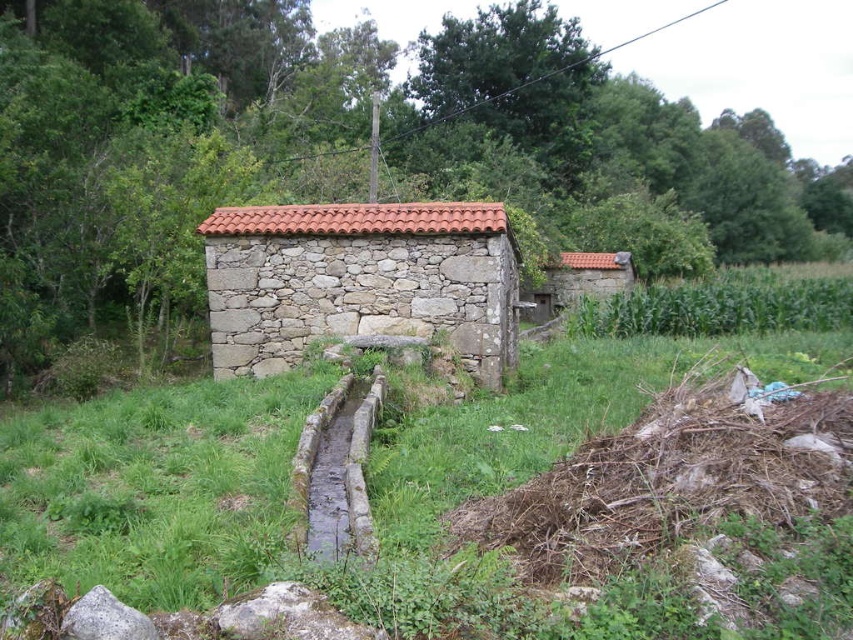
What do you see at coordinates (360, 280) in the screenshot?
I see `stone textured hut at center` at bounding box center [360, 280].

Does point (485, 268) come farther from viewer compared to point (802, 321)?

No, it is in front of (802, 321).

You are a GUI agent. You are given a task and a screenshot of the screen. Output one action in this format:
    pyautogui.click(x=<x>, y=<y>)
    Task: Click on the stone textured hut at center
    
    Given the screenshot: What is the action you would take?
    pyautogui.click(x=360, y=280)